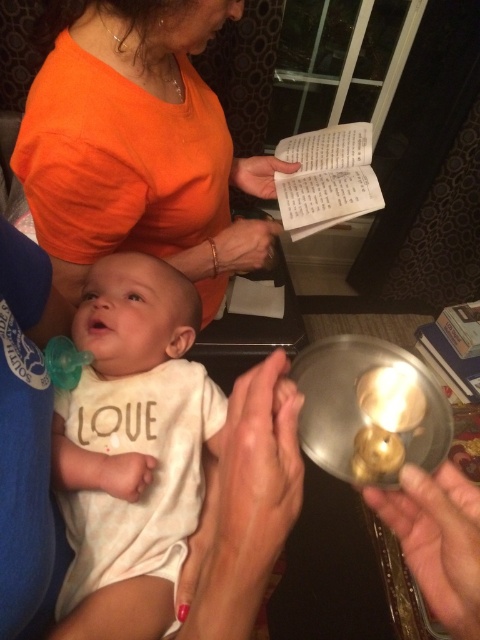
Question: Can you confirm if white soft cotton onesie at center is bigger than smooth skin hand at center?

Choices:
 (A) no
 (B) yes

Answer: (B)

Question: Can you confirm if metallic gold ring at lower right is positioned to the right of white paper book at upper center?

Choices:
 (A) no
 (B) yes

Answer: (A)

Question: From the image, what is the correct spatial relationship of smooth skin hand at center in relation to matte orange shirt at upper center?

Choices:
 (A) left
 (B) right

Answer: (A)

Question: Which of the following is the closest to the observer?

Choices:
 (A) matte orange shirt at upper center
 (B) smooth skin hand at center
 (C) white paper book at upper center

Answer: (B)

Question: Among these points, which one is farthest from the camera?

Choices:
 (A) (224, 545)
 (B) (73, 435)

Answer: (B)

Question: Estimate the real-world distances between objects in this image. Which object is closer to the orange cotton shirt at upper left?

Choices:
 (A) white soft cotton onesie at center
 (B) white paper at upper center
 (C) metallic gold ring at lower right
 (D) matte orange shirt at upper center

Answer: (D)